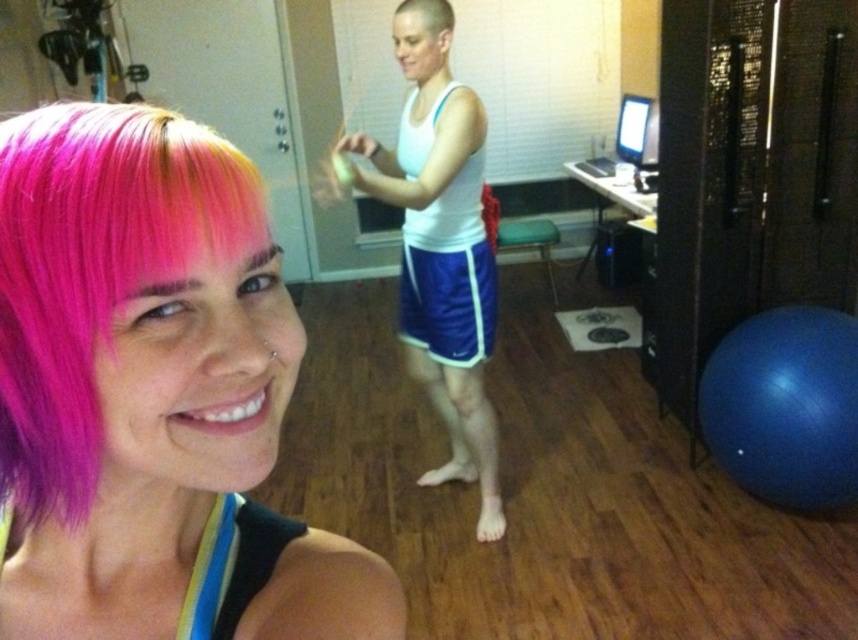
Question: Is pink matte hair at center in front of blue fabric shorts at center?

Choices:
 (A) yes
 (B) no

Answer: (A)

Question: Considering the real-world distances, which object is closest to the pink matte hair at center?

Choices:
 (A) blue fabric shorts at center
 (B) white matte tank top at center

Answer: (B)

Question: Based on their relative distances, which object is nearer to the blue fabric shorts at center?

Choices:
 (A) white matte tank top at center
 (B) pink matte hair at center

Answer: (A)

Question: Where is pink matte hair at center located in relation to white matte tank top at center in the image?

Choices:
 (A) below
 (B) above

Answer: (A)

Question: Which of the following is the closest to the observer?

Choices:
 (A) blue fabric shorts at center
 (B) pink matte hair at center
 (C) white matte tank top at center
 (D) shiny white hair at center

Answer: (B)

Question: Is pink matte hair at center in front of blue fabric shorts at center?

Choices:
 (A) yes
 (B) no

Answer: (A)